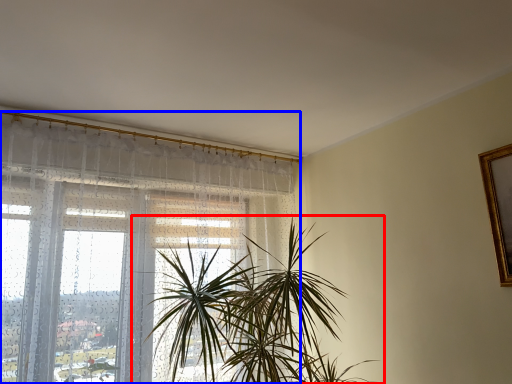
Question: Which point is closer to the camera, houseplant (highlighted by a red box) or window (highlighted by a blue box)?

Choices:
 (A) houseplant
 (B) window

Answer: (A)